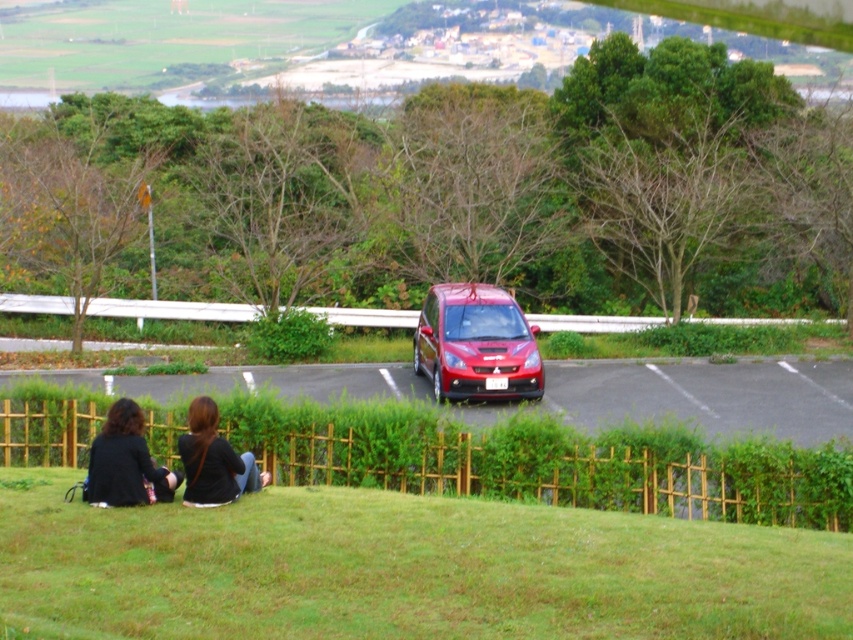
Who is more forward, (610,250) or (519,337)?

Positioned in front is point (519,337).

Does point (674, 301) lie in front of point (425, 356)?

No, it is not.

This screenshot has height=640, width=853. Identify the location of green leafy hedge at center. (505, 189).

Can you confirm if glossy red car at center is positioned above black fabric shirt at lower left?

Indeed, glossy red car at center is positioned over black fabric shirt at lower left.

Does glossy red car at center have a smaller size compared to black fabric shirt at lower left?

No.

The width and height of the screenshot is (853, 640). Identify the location of glossy red car at center. (476, 344).

The height and width of the screenshot is (640, 853). What are the coordinates of `glossy red car at center` in the screenshot? It's located at pos(476,344).

Is green bamboo fence at lower center taller than black fabric shirt at lower left?

No.

Between point (264, 426) and point (230, 468), which one is positioned behind?

Positioned behind is point (264, 426).

What do you see at coordinates (544, 461) in the screenshot?
I see `green bamboo fence at lower center` at bounding box center [544, 461].

Identify the location of green bamboo fence at lower center. (544, 461).